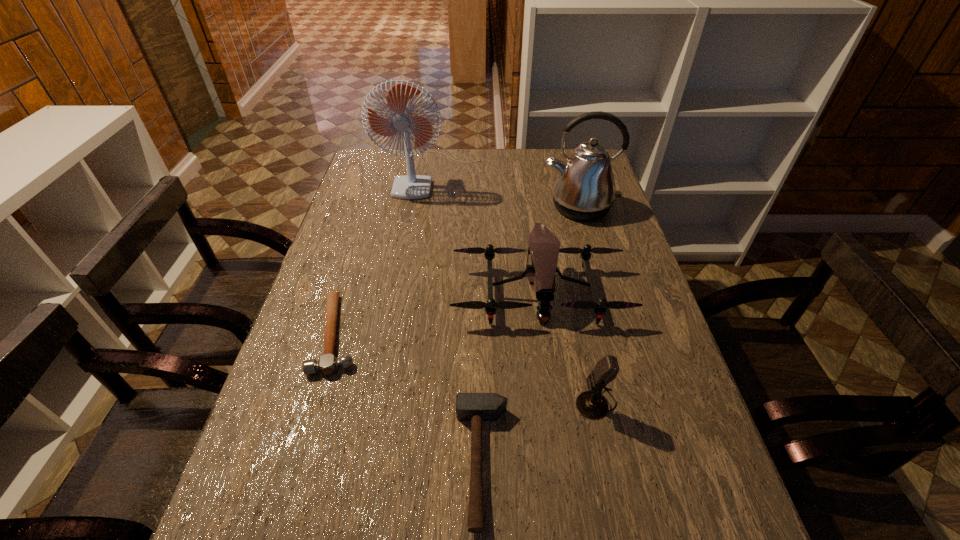
I want to click on hammer located in the left edge section of the desktop, so click(327, 364).

Where is `kettle positioned at the right edge`? kettle positioned at the right edge is located at coordinates (584, 189).

Identify the location of drone at the right edge. The width and height of the screenshot is (960, 540). (544, 247).

What are the coordinates of `microphone present at the right edge` in the screenshot? It's located at (591, 404).

Image resolution: width=960 pixels, height=540 pixels. Find the location of `object that is positioned at the far left corner`. object that is positioned at the far left corner is located at coordinates (401, 119).

This screenshot has width=960, height=540. Find the location of `free space at the far edge`. free space at the far edge is located at coordinates (461, 168).

I want to click on vacant area at the left edge, so click(x=372, y=245).

Locate an element on the screen. vacant space at the right edge of the desktop is located at coordinates (660, 376).

The image size is (960, 540). I want to click on vacant space at the far left corner of the desktop, so click(385, 156).

This screenshot has width=960, height=540. I want to click on vacant space that is in between the microphone and the shorter hammer, so point(468,368).